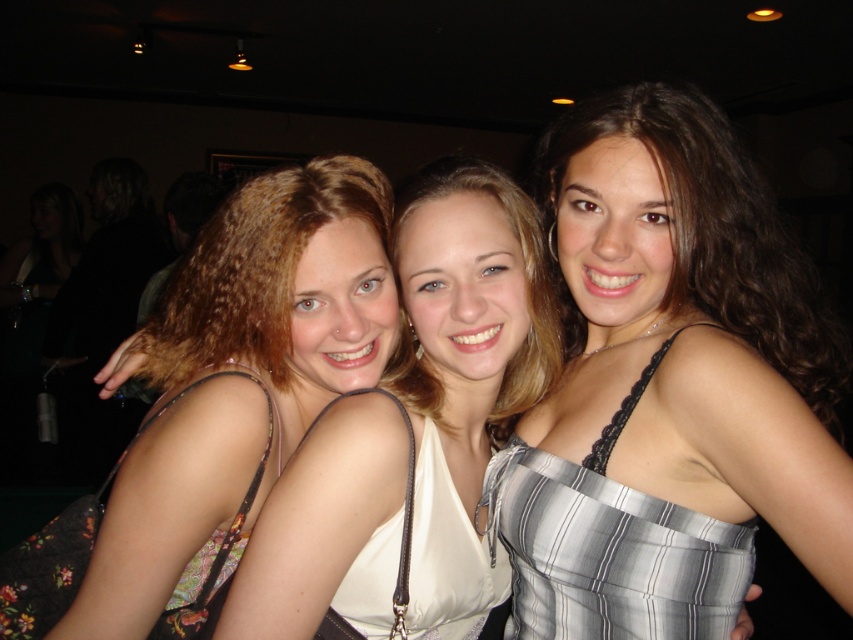
This screenshot has width=853, height=640. What do you see at coordinates (219, 403) in the screenshot? I see `blonde hair at left` at bounding box center [219, 403].

Based on the photo, does blonde hair at left have a greater width compared to floral-patterned fabric dress at left?

Correct, the width of blonde hair at left exceeds that of floral-patterned fabric dress at left.

Find the location of a particular element. This screenshot has width=853, height=640. blonde hair at left is located at coordinates (219, 403).

Describe the element at coordinates (219, 403) in the screenshot. I see `blonde hair at left` at that location.

Which of these two, blonde hair at left or striped satin dress at center, stands taller?

Standing taller between the two is blonde hair at left.

The width and height of the screenshot is (853, 640). Describe the element at coordinates (219, 403) in the screenshot. I see `blonde hair at left` at that location.

At what (x,y) coordinates should I click in order to perform the action: click on blonde hair at left. Please return your answer as a coordinate pair (x, y). Image resolution: width=853 pixels, height=640 pixels. Looking at the image, I should click on (219, 403).

In the scene shown: Is matte floral dress at center above white satin dress at center?

Yes, matte floral dress at center is above white satin dress at center.

Is point (463, 627) farther from viewer compared to point (448, 596)?

Yes, it is.

The height and width of the screenshot is (640, 853). I want to click on matte floral dress at center, so click(x=466, y=362).